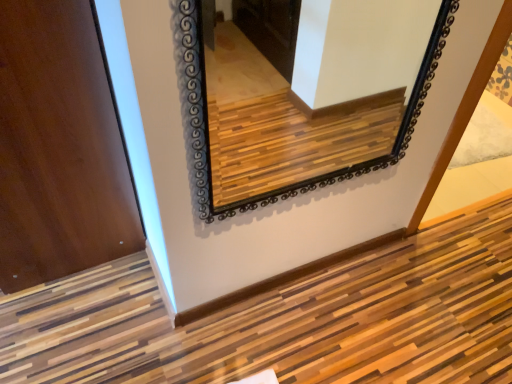
Question: In terms of height, does matte wood door at left look taller or shorter compared to black glass mirror at upper center?

Choices:
 (A) short
 (B) tall

Answer: (B)

Question: Considering the positions of matte wood door at left and black glass mirror at upper center in the image, is matte wood door at left wider or thinner than black glass mirror at upper center?

Choices:
 (A) wide
 (B) thin

Answer: (A)

Question: Visually, is matte wood door at left positioned to the left or to the right of black glass mirror at upper center?

Choices:
 (A) left
 (B) right

Answer: (A)

Question: From their relative heights in the image, would you say black glass mirror at upper center is taller or shorter than matte wood door at left?

Choices:
 (A) tall
 (B) short

Answer: (B)

Question: From the image's perspective, is black glass mirror at upper center located above or below matte wood door at left?

Choices:
 (A) above
 (B) below

Answer: (B)

Question: Considering the positions of black glass mirror at upper center and matte wood door at left in the image, is black glass mirror at upper center wider or thinner than matte wood door at left?

Choices:
 (A) wide
 (B) thin

Answer: (B)

Question: From a real-world perspective, is black glass mirror at upper center above or below matte wood door at left?

Choices:
 (A) below
 (B) above

Answer: (B)